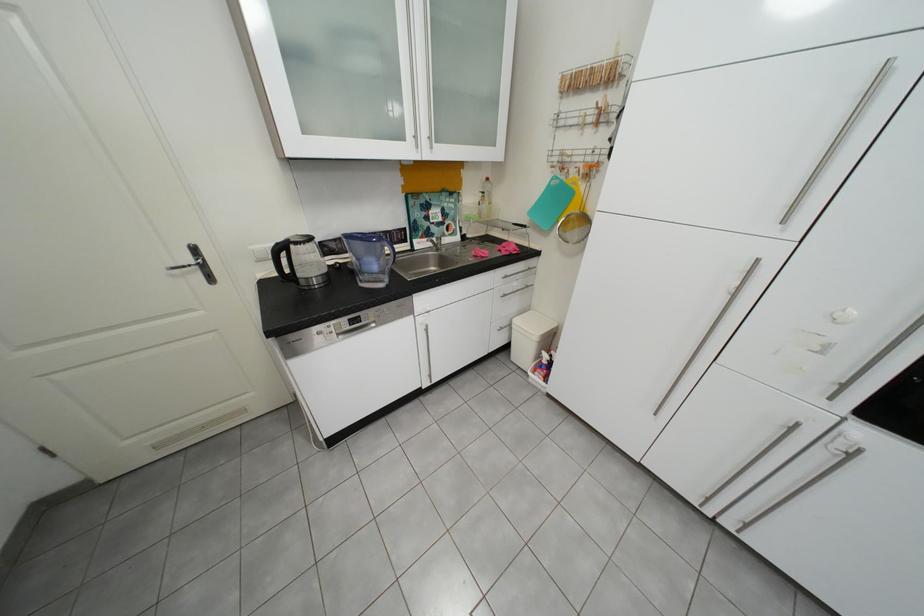
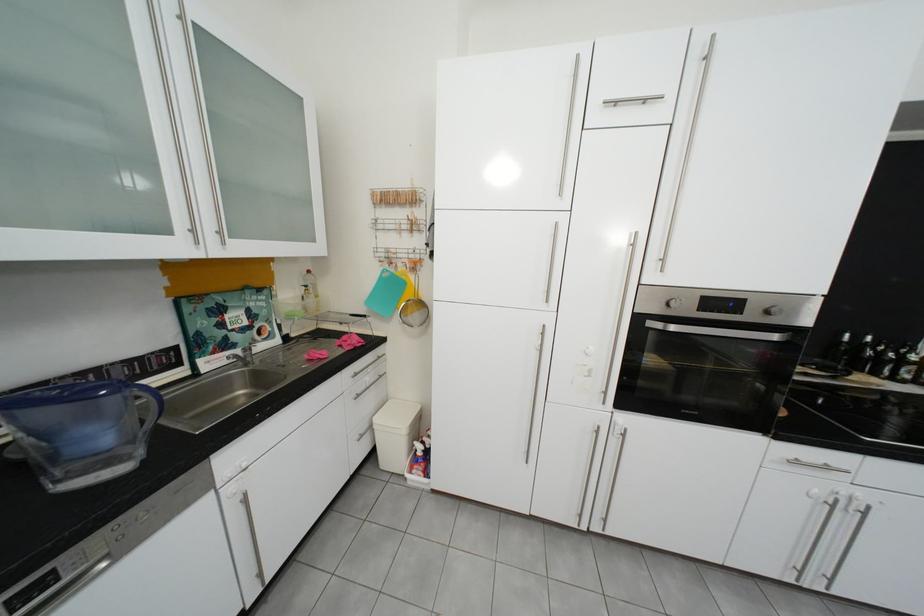
Locate, in the second image, the point that corresponds to the point at 593,114 in the first image.

(408, 223)